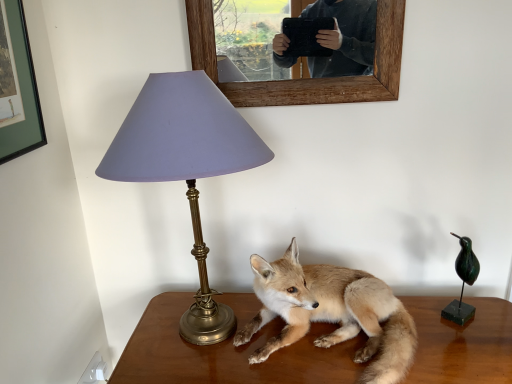
Identify the location of free location above brown wooden table at center (from a real-world perspective). (353, 338).